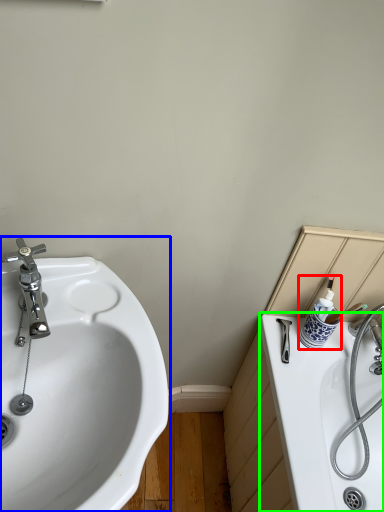
Question: Which is nearer to the toiletry (highlighted by a red box)? sink (highlighted by a blue box) or bath (highlighted by a green box).

Choices:
 (A) sink
 (B) bath

Answer: (B)